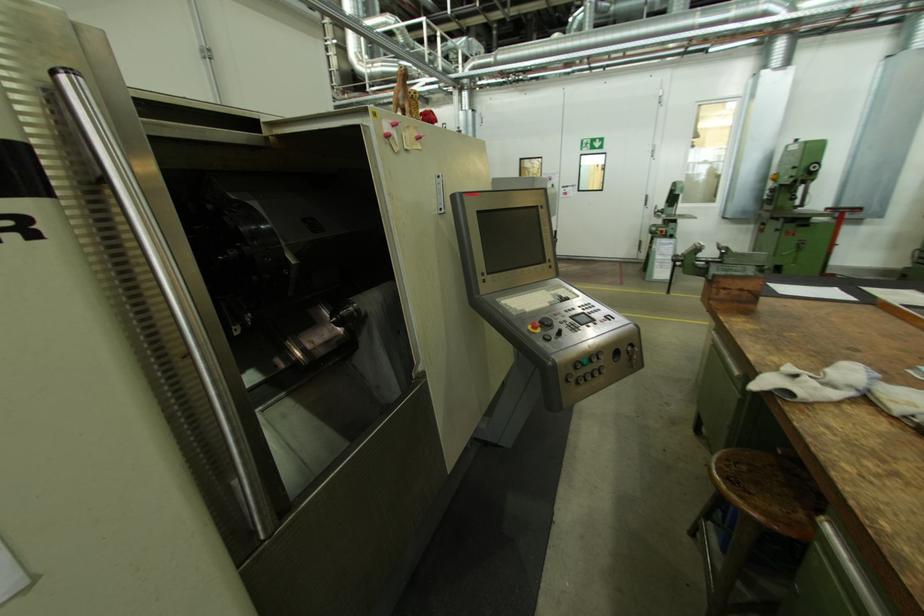
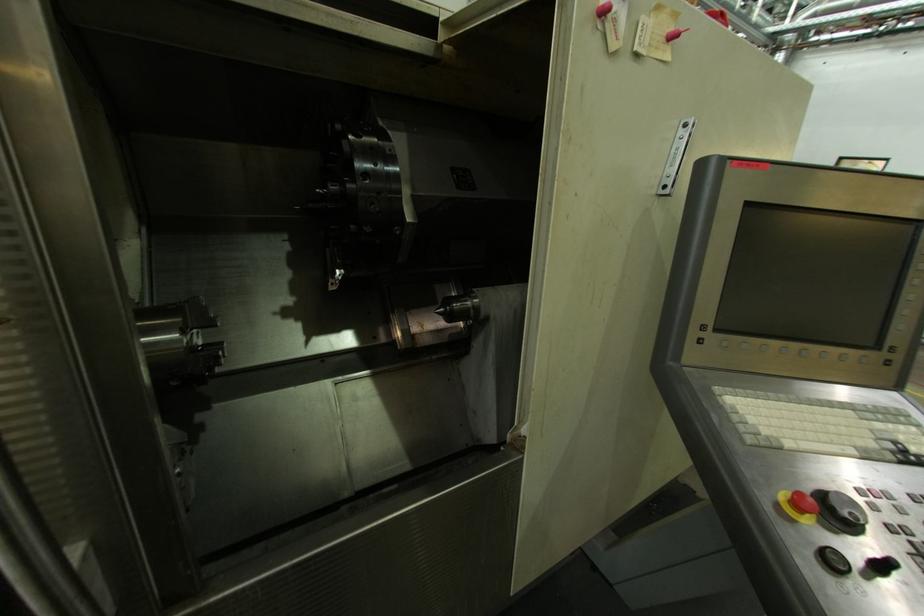
Where in the second image is the point corresponding to point 565,334 from the first image?

(888, 569)